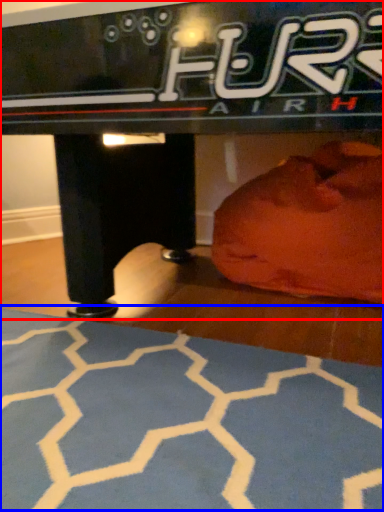
Question: Which point is further to the camera, table (highlighted by a red box) or yoga mat (highlighted by a blue box)?

Choices:
 (A) table
 (B) yoga mat

Answer: (A)